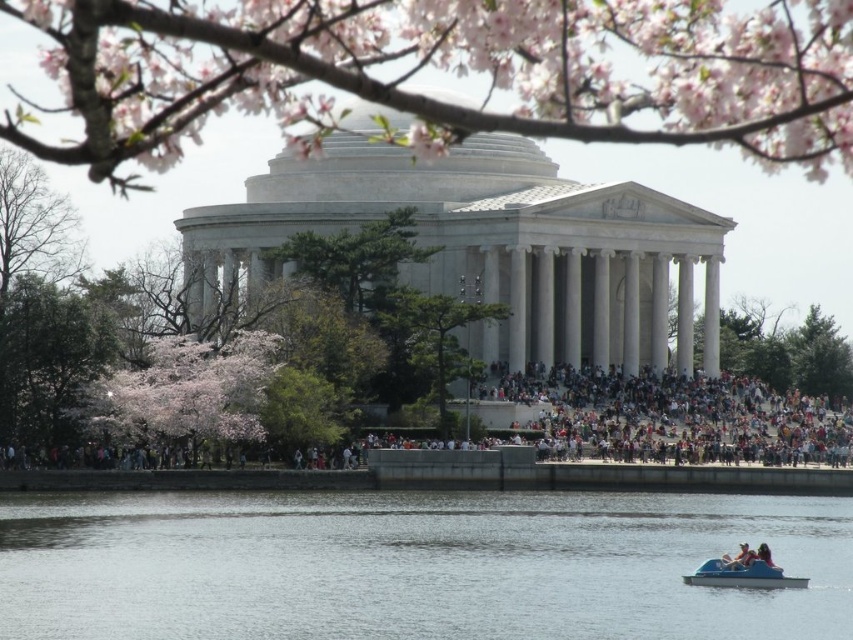
You are a photographer planning to capture the Jefferson Memorial with the cherry blossoms in the foreground. Given the pink blossoms at lower left and the green leafy tree at center, which of these two elements is positioned closer to the left side of the frame?

The pink blossoms at lower left are positioned to the left of the green leafy tree at center, so they are closer to the left side of the frame.

You are standing at point (401, 288) and want to walk to the Jefferson Memorial. There is a point at (267, 609) in your path. Is this point in front of or behind you relative to your direction of travel?

The point at (267, 609) is in front of point (401, 288), so it is in front of you as you walk towards the Jefferson Memorial.

You are a tourist standing at the base of the Jefferson Memorial steps. You see the clear water at lower center and the green leafy tree at center. Which object is closer to your current position?

The clear water at lower center is closer to your current position because it is located below the green leafy tree at center.